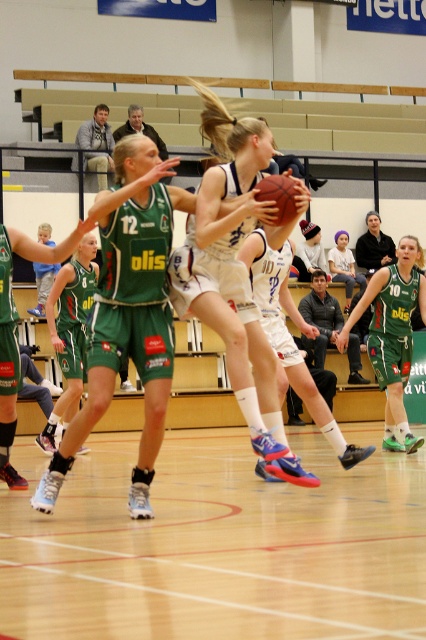
Is point (370, 352) behind point (389, 237)?

No.

Can you confirm if green jersey at center is positioned to the right of dark green jersey at center?

No, green jersey at center is not to the right of dark green jersey at center.

This screenshot has height=640, width=426. What are the coordinates of `green jersey at center` in the screenshot? It's located at (393, 333).

Does white matte basketball player at center appear under rubber textured basketball at center?

Yes.

Between white matte basketball player at center and rubber textured basketball at center, which one is positioned lower?

Positioned lower is white matte basketball player at center.

Between point (275, 410) and point (284, 179), which one is positioned behind?

Point (275, 410)

Locate an element on the screen. This screenshot has width=426, height=640. white matte basketball player at center is located at coordinates (236, 273).

Between point (253, 141) and point (282, 204), which one is positioned in front?

Positioned in front is point (282, 204).

Locate an element on the screen. Image resolution: width=426 pixels, height=640 pixels. white jersey at center is located at coordinates (48, 490).

Identify the location of white jersey at center. This screenshot has height=640, width=426. (48, 490).